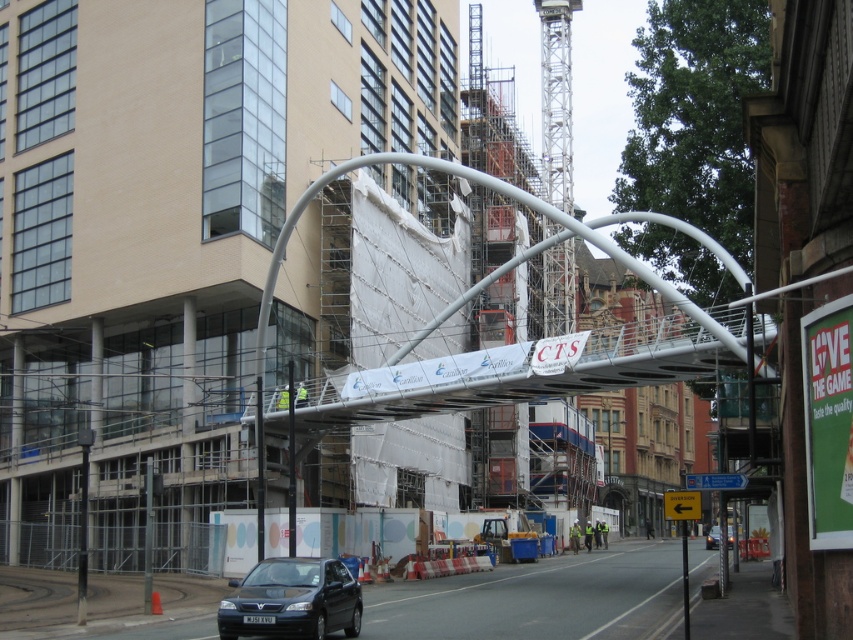
You are a delivery driver who needs to park your matte black car at lower center in a spot that requires precise positioning. The parking spot is a rectangle with corners at coordinates 0.9, 0.3 and 1.0, 0.4. Is the car already positioned correctly within this spot?

The matte black car at lower center is located at point (291, 600). The parking spot spans from (254, 576) to (340, 639). Since the car is within these boundaries, it is correctly positioned in the parking spot.

You are a delivery driver who needs to park your delivery van between the matte black car at lower center and the black glossy car at center. Given that your van is 6 meters long, can you fit it in the space between them?

The matte black car at lower center is smaller than the black glossy car at center, but the exact distance between them isn not provided. Without knowing the space between the two cars, it is impossible to determine if the van will fit.

You are a delivery driver who needs to park your vehicle in the construction area. You have two cars available, the matte black car at lower center and the black glossy car at center. Which car should you choose to ensure it fits under the bridge with a height restriction of 1.8 meters?

The matte black car at lower center is shorter than the black glossy car at center. Therefore, the matte black car at lower center would fit under the bridge with the 1.8 meters height restriction.